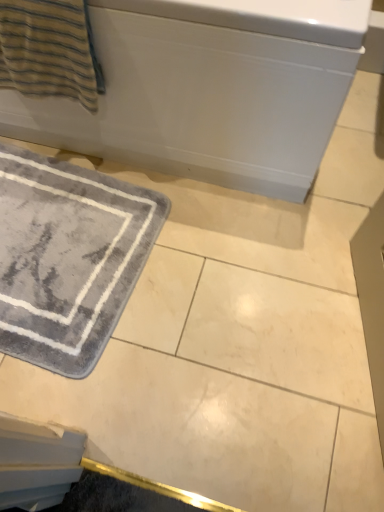
Question: From the image's perspective, does gray plush bath mat at lower left appear higher than striped cotton towel at upper left?

Choices:
 (A) yes
 (B) no

Answer: (B)

Question: Can you confirm if gray plush bath mat at lower left is wider than striped cotton towel at upper left?

Choices:
 (A) yes
 (B) no

Answer: (A)

Question: From the image's perspective, would you say gray plush bath mat at lower left is shown under striped cotton towel at upper left?

Choices:
 (A) no
 (B) yes

Answer: (B)

Question: Does gray plush bath mat at lower left lie behind striped cotton towel at upper left?

Choices:
 (A) yes
 (B) no

Answer: (A)

Question: Considering the relative sizes of gray plush bath mat at lower left and striped cotton towel at upper left in the image provided, is gray plush bath mat at lower left thinner than striped cotton towel at upper left?

Choices:
 (A) yes
 (B) no

Answer: (B)

Question: Could you tell me if gray plush bath mat at lower left is facing striped cotton towel at upper left?

Choices:
 (A) no
 (B) yes

Answer: (A)

Question: Is the depth of white glossy bathtub at upper center less than that of gray plush bath mat at lower left?

Choices:
 (A) no
 (B) yes

Answer: (B)

Question: Is white glossy bathtub at upper center to the right of gray plush bath mat at lower left from the viewer's perspective?

Choices:
 (A) no
 (B) yes

Answer: (B)

Question: Is white glossy bathtub at upper center outside gray plush bath mat at lower left?

Choices:
 (A) no
 (B) yes

Answer: (B)

Question: From a real-world perspective, is white glossy bathtub at upper center physically above gray plush bath mat at lower left?

Choices:
 (A) yes
 (B) no

Answer: (A)

Question: Is there a large distance between white glossy bathtub at upper center and gray plush bath mat at lower left?

Choices:
 (A) no
 (B) yes

Answer: (A)

Question: Is white glossy bathtub at upper center in contact with gray plush bath mat at lower left?

Choices:
 (A) no
 (B) yes

Answer: (A)

Question: From the image's perspective, would you say gray plush bath mat at lower left is shown under white glossy bathtub at upper center?

Choices:
 (A) yes
 (B) no

Answer: (A)